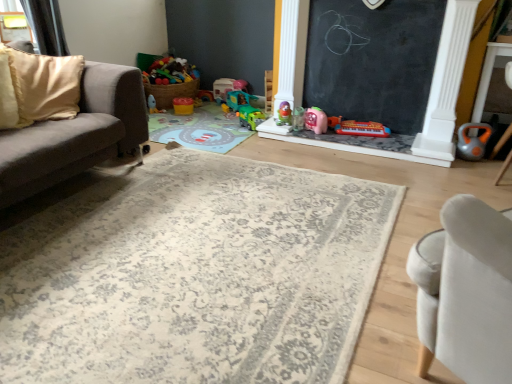
The image size is (512, 384). Identify the location of vacant space underneath orange rubber kettlebell at right, placed as the 1th toy when sorted from right to left (from a real-world perspective). (473, 157).